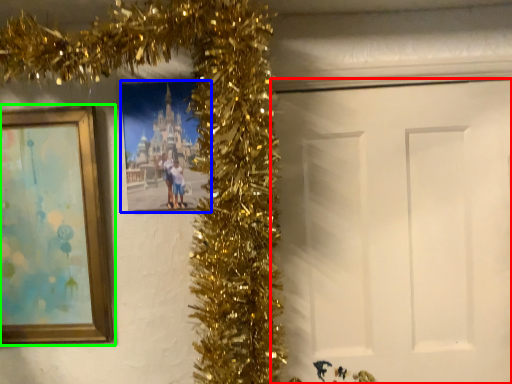
Question: Considering the real-world distances, which object is farthest from door (highlighted by a red box)? picture frame (highlighted by a blue box) or picture frame (highlighted by a green box)?

Choices:
 (A) picture frame
 (B) picture frame

Answer: (B)